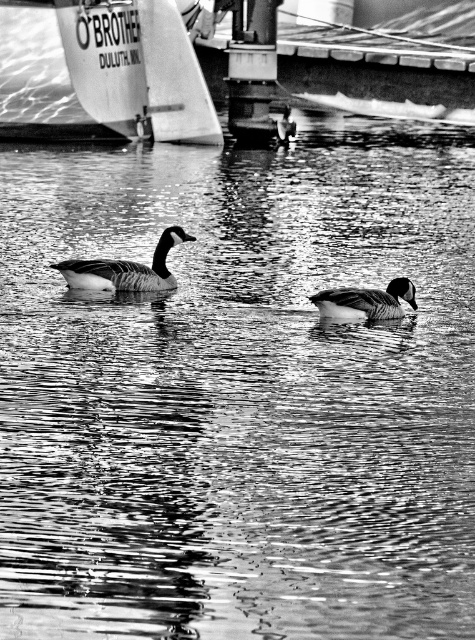
Does white sailboat at upper left lie in front of smooth gray duck at center?

No, it is not.

Is point (151, 3) closer to viewer compared to point (354, 307)?

No.

Locate an element on the screen. This screenshot has height=640, width=475. white sailboat at upper left is located at coordinates (136, 68).

Does dark gray matte duck at center have a lesser width compared to smooth gray duck at center?

No.

Based on the photo, can you confirm if dark gray matte duck at center is bigger than smooth gray duck at center?

Yes.

Is point (72, 273) closer to camera compared to point (332, 316)?

No.

Locate an element on the screen. dark gray matte duck at center is located at coordinates (125, 268).

Which is below, white sailboat at upper left or dark gray matte duck at center?

Positioned lower is dark gray matte duck at center.

Which of these two, white sailboat at upper left or dark gray matte duck at center, stands taller?

Standing taller between the two is white sailboat at upper left.

Locate an element on the screen. white sailboat at upper left is located at coordinates (136, 68).

At what (x,y) coordinates should I click in order to perform the action: click on white sailboat at upper left. Please return your answer as a coordinate pair (x, y). The width and height of the screenshot is (475, 640). Looking at the image, I should click on (136, 68).